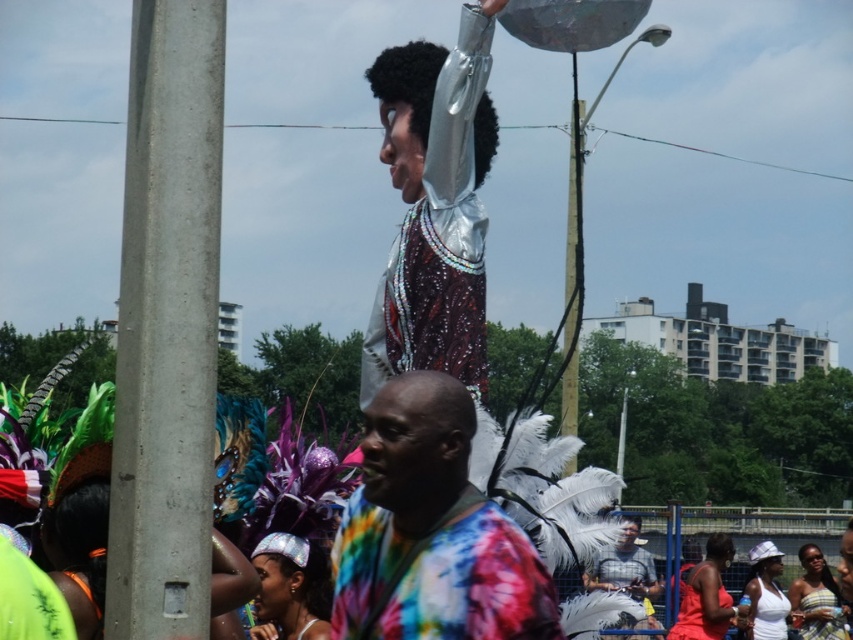
Question: Based on their relative distances, which object is farther from the tie-dye fabric shirt at center?

Choices:
 (A) gray cotton shirt at center
 (B) white matte tank top at lower right
 (C) shiny metallic costume at center
 (D) patterned fabric headdress at center

Answer: (D)

Question: Which point appears closest to the camera in this image?

Choices:
 (A) (784, 624)
 (B) (445, 353)

Answer: (B)

Question: Can you confirm if gray cotton shirt at center is positioned above matte pink tank top at lower right?

Choices:
 (A) yes
 (B) no

Answer: (A)

Question: Can you confirm if tie-dye fabric shirt at center is positioned below gray cotton shirt at center?

Choices:
 (A) no
 (B) yes

Answer: (A)

Question: Among these objects, which one is nearest to the camera?

Choices:
 (A) white matte tank top at lower right
 (B) patterned fabric headdress at center
 (C) matte pink tank top at lower right

Answer: (C)

Question: Does tie-dye fabric shirt at center appear over white matte tank top at lower right?

Choices:
 (A) no
 (B) yes

Answer: (B)